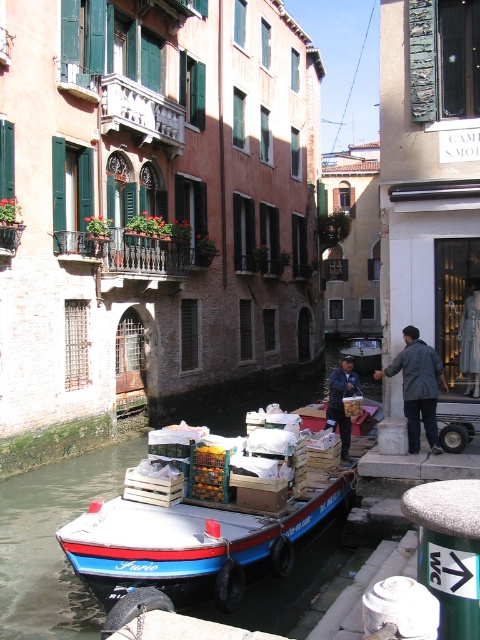
Question: Is the position of blue painted wooden boat at center less distant than that of dark blue jeans at center?

Choices:
 (A) yes
 (B) no

Answer: (A)

Question: Which point is closer to the camera taking this photo?

Choices:
 (A) (132, 579)
 (B) (411, 426)
 (C) (364, 372)

Answer: (A)

Question: Considering the relative positions of blue painted wooden boat at center and dark blue jeans at center in the image provided, where is blue painted wooden boat at center located with respect to dark blue jeans at center?

Choices:
 (A) above
 (B) below

Answer: (B)

Question: Is blue painted wooden boat at center thinner than dark blue jeans at center?

Choices:
 (A) yes
 (B) no

Answer: (A)

Question: Among these points, which one is nearest to the camera?

Choices:
 (A) (405, 339)
 (B) (376, 362)
 (C) (175, 548)

Answer: (C)

Question: Considering the real-world distances, which object is closest to the blue painted wooden boat at center?

Choices:
 (A) dark gray jacket at center
 (B) dark blue jeans at center

Answer: (A)